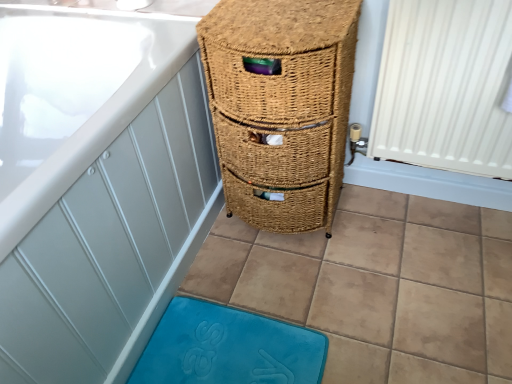
Question: Considering the positions of white ribbed radiator at right and blue plush bath mat at lower center in the image, is white ribbed radiator at right wider or thinner than blue plush bath mat at lower center?

Choices:
 (A) thin
 (B) wide

Answer: (A)

Question: Which is correct: white ribbed radiator at right is inside blue plush bath mat at lower center, or outside of it?

Choices:
 (A) outside
 (B) inside

Answer: (A)

Question: Which of these objects is positioned farthest from the blue plush bath mat at lower center?

Choices:
 (A) white ribbed radiator at right
 (B) woven brown drawer at center

Answer: (A)

Question: Estimate the real-world distances between objects in this image. Which object is closer to the white ribbed radiator at right?

Choices:
 (A) blue plush bath mat at lower center
 (B) woven brown drawer at center

Answer: (B)